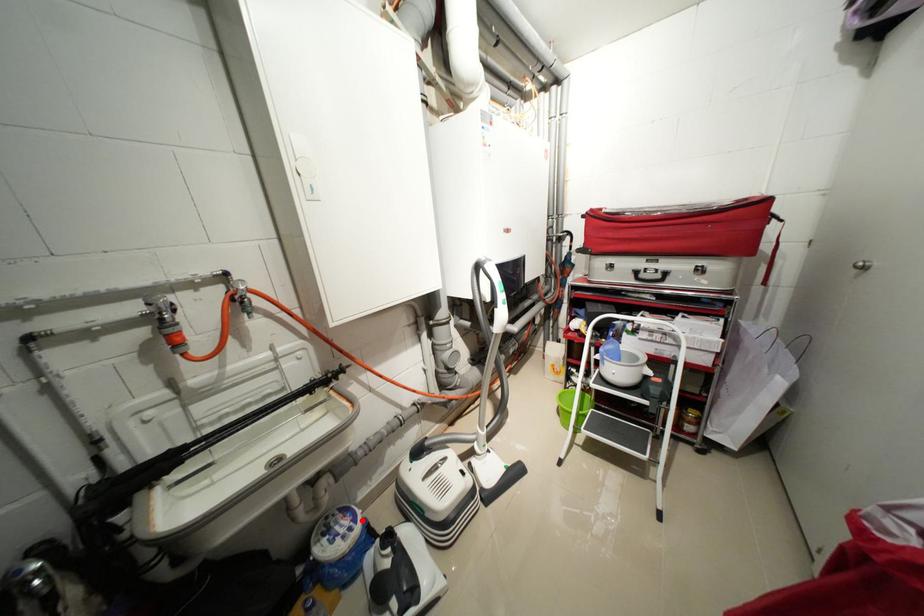
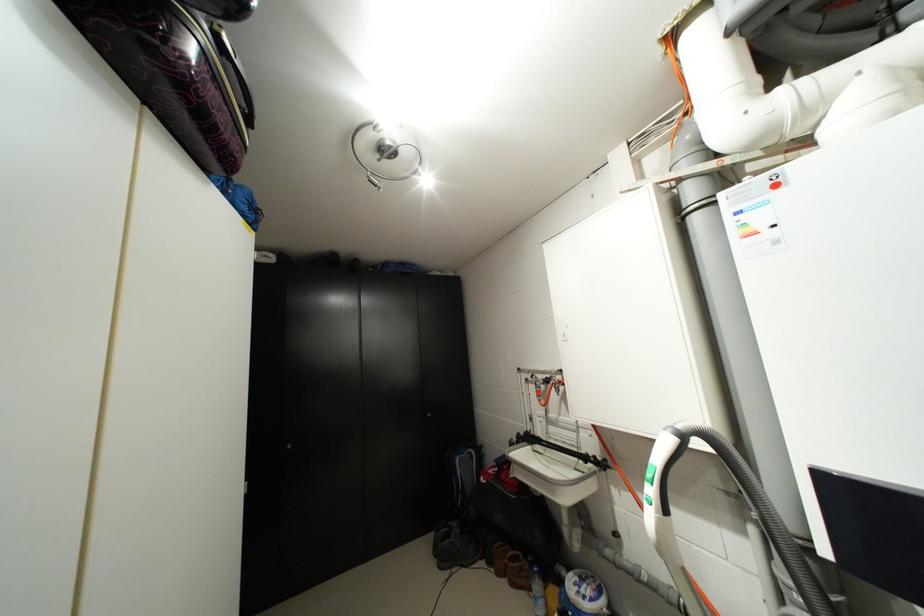
Question: I am providing you with two images of the same scene from different viewpoints. A red point is shown in image1. For the corresponding object point in image2, is it positioned nearer or farther from the camera?

Choices:
 (A) Nearer
 (B) Farther

Answer: (B)